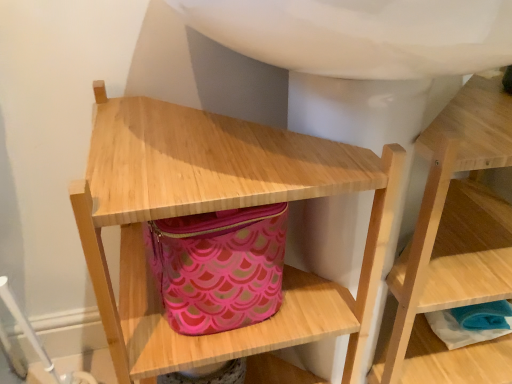
Question: In which direction should I rotate to look at natural wood shelf at center, which appears as the 2th shelf when viewed from the right?

Choices:
 (A) left
 (B) right

Answer: (A)

Question: Are wooden shelf at center, which appears as the first shelf when viewed from the right, and natural wood shelf at center, which ranks as the 1th shelf in left-to-right order, located far from each other?

Choices:
 (A) yes
 (B) no

Answer: (B)

Question: From a real-world perspective, does wooden shelf at center, which appears as the first shelf when viewed from the right, stand above natural wood shelf at center, which appears as the 2th shelf when viewed from the right?

Choices:
 (A) yes
 (B) no

Answer: (B)

Question: From the image's perspective, is wooden shelf at center, which appears as the first shelf when viewed from the right, under natural wood shelf at center, which ranks as the 1th shelf in left-to-right order?

Choices:
 (A) yes
 (B) no

Answer: (B)

Question: From a real-world perspective, is wooden shelf at center, positioned as the second shelf in left-to-right order, located beneath natural wood shelf at center, which ranks as the 1th shelf in left-to-right order?

Choices:
 (A) no
 (B) yes

Answer: (B)

Question: Is wooden shelf at center, positioned as the second shelf in left-to-right order, oriented towards natural wood shelf at center, which appears as the 2th shelf when viewed from the right?

Choices:
 (A) yes
 (B) no

Answer: (B)

Question: Is wooden shelf at center, positioned as the second shelf in left-to-right order, positioned behind natural wood shelf at center, which ranks as the 1th shelf in left-to-right order?

Choices:
 (A) no
 (B) yes

Answer: (B)

Question: Can you confirm if pink fabric bag at center is bigger than natural wood shelf at center, which ranks as the 1th shelf in left-to-right order?

Choices:
 (A) no
 (B) yes

Answer: (A)

Question: Is pink fabric bag at center smaller than natural wood shelf at center, which appears as the 2th shelf when viewed from the right?

Choices:
 (A) no
 (B) yes

Answer: (B)

Question: Is pink fabric bag at center not close to natural wood shelf at center, which appears as the 2th shelf when viewed from the right?

Choices:
 (A) yes
 (B) no

Answer: (B)

Question: Considering the relative sizes of pink fabric bag at center and natural wood shelf at center, which appears as the 2th shelf when viewed from the right, in the image provided, is pink fabric bag at center shorter than natural wood shelf at center, which appears as the 2th shelf when viewed from the right,?

Choices:
 (A) no
 (B) yes

Answer: (B)

Question: Can you confirm if pink fabric bag at center is positioned to the left of natural wood shelf at center, which ranks as the 1th shelf in left-to-right order?

Choices:
 (A) yes
 (B) no

Answer: (A)

Question: From the image's perspective, is pink fabric bag at center above natural wood shelf at center, which ranks as the 1th shelf in left-to-right order?

Choices:
 (A) no
 (B) yes

Answer: (B)

Question: Considering the relative sizes of natural wood shelf at center, which appears as the 2th shelf when viewed from the right, and wooden shelf at center, positioned as the second shelf in left-to-right order, in the image provided, is natural wood shelf at center, which appears as the 2th shelf when viewed from the right, shorter than wooden shelf at center, positioned as the second shelf in left-to-right order,?

Choices:
 (A) no
 (B) yes

Answer: (A)